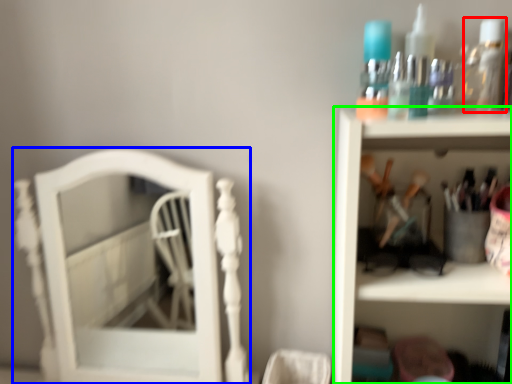
Question: Which is nearer to the mouthwash (highlighted by a red box)? furniture (highlighted by a blue box) or shelf (highlighted by a green box).

Choices:
 (A) furniture
 (B) shelf

Answer: (B)